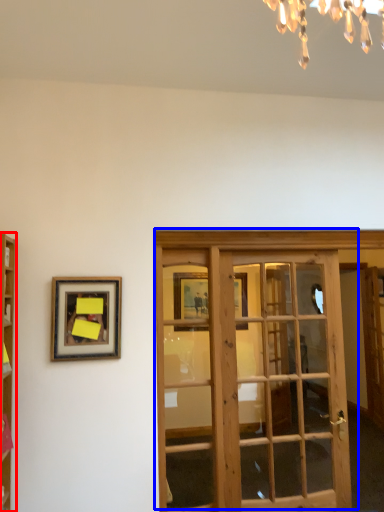
Question: Which point is closer to the camera, cabinetry (highlighted by a red box) or door (highlighted by a blue box)?

Choices:
 (A) cabinetry
 (B) door

Answer: (A)